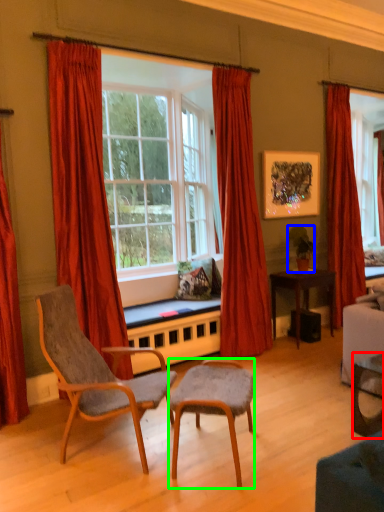
Question: Which object is positioned farthest from desk (highlighted by a red box)? Select from houseplant (highlighted by a blue box) and chair (highlighted by a green box).

Choices:
 (A) houseplant
 (B) chair

Answer: (A)